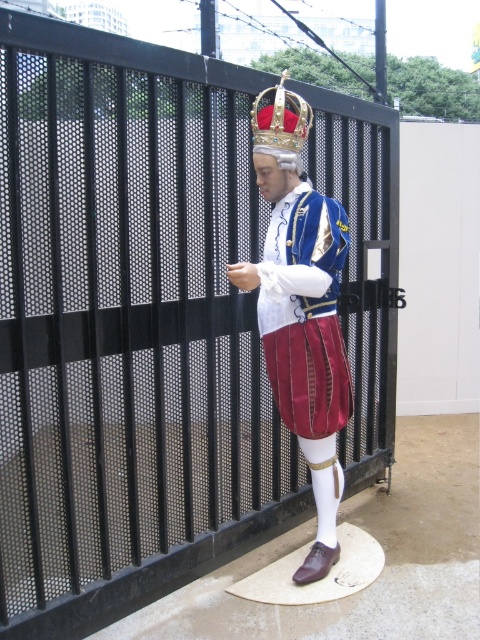
Which is more to the left, velvet maroon pants at center or goldmetalliccrown at upper center?

goldmetalliccrown at upper center

Who is lower down, velvet maroon pants at center or goldmetalliccrown at upper center?

Positioned lower is velvet maroon pants at center.

Who is more distant from viewer, [331,292] or [253,138]?

The point [331,292] is more distant.

Where is `velvet maroon pants at center`? This screenshot has width=480, height=640. velvet maroon pants at center is located at coordinates (307, 314).

Is velvet blue jacket at center to the right of goldmetalliccrown at upper center from the viewer's perspective?

Correct, you'll find velvet blue jacket at center to the right of goldmetalliccrown at upper center.

Is velvet blue jacket at center in front of goldmetalliccrown at upper center?

That is True.

Which is in front, point (336, 461) or point (282, 81)?

Point (282, 81) is in front.

This screenshot has width=480, height=640. In order to click on velvet blue jacket at center in this screenshot , I will do `click(300, 307)`.

Is velvet blue jacket at center bigger than velvet maroon pants at center?

Yes, velvet blue jacket at center is bigger than velvet maroon pants at center.

Who is positioned more to the right, velvet blue jacket at center or velvet maroon pants at center?

velvet maroon pants at center

The height and width of the screenshot is (640, 480). What do you see at coordinates (300, 307) in the screenshot? I see `velvet blue jacket at center` at bounding box center [300, 307].

This screenshot has width=480, height=640. Find the location of `velvet blue jacket at center`. velvet blue jacket at center is located at coordinates (300, 307).